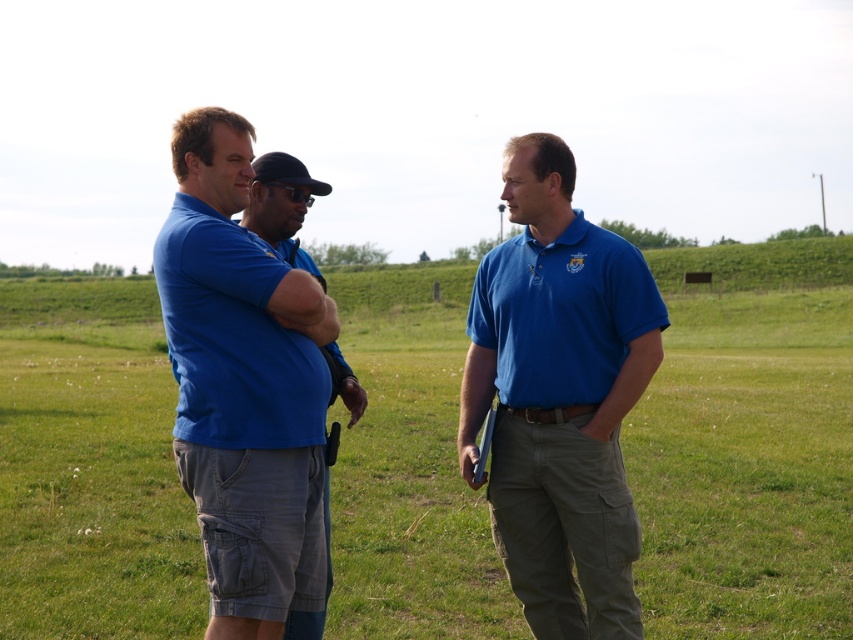
Question: Observing the image, what is the correct spatial positioning of blue cotton shirt at left in reference to matte blue polo shirt at left?

Choices:
 (A) right
 (B) left

Answer: (A)

Question: Considering the relative positions of matte blue shirt at center and matte blue polo shirt at left in the image provided, where is matte blue shirt at center located with respect to matte blue polo shirt at left?

Choices:
 (A) right
 (B) left

Answer: (A)

Question: Which point is closer to the camera?

Choices:
 (A) matte blue polo shirt at left
 (B) matte blue polo shirt at center

Answer: (A)

Question: Among these points, which one is farthest from the camera?

Choices:
 (A) (772, 481)
 (B) (473, 344)
 (C) (256, 392)
 (D) (485, 298)

Answer: (A)

Question: Which point is farther from the camera taking this photo?

Choices:
 (A) (288, 328)
 (B) (408, 618)
 (C) (532, 289)

Answer: (B)

Question: Does matte blue shirt at center appear on the right side of matte blue polo shirt at left?

Choices:
 (A) yes
 (B) no

Answer: (A)